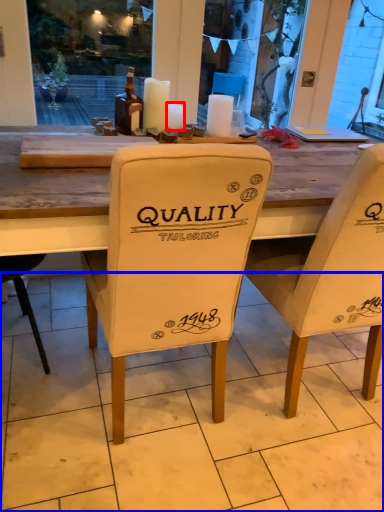
Question: Which point is further to the camera, candle (highlighted by a red box) or tile (highlighted by a blue box)?

Choices:
 (A) candle
 (B) tile

Answer: (A)